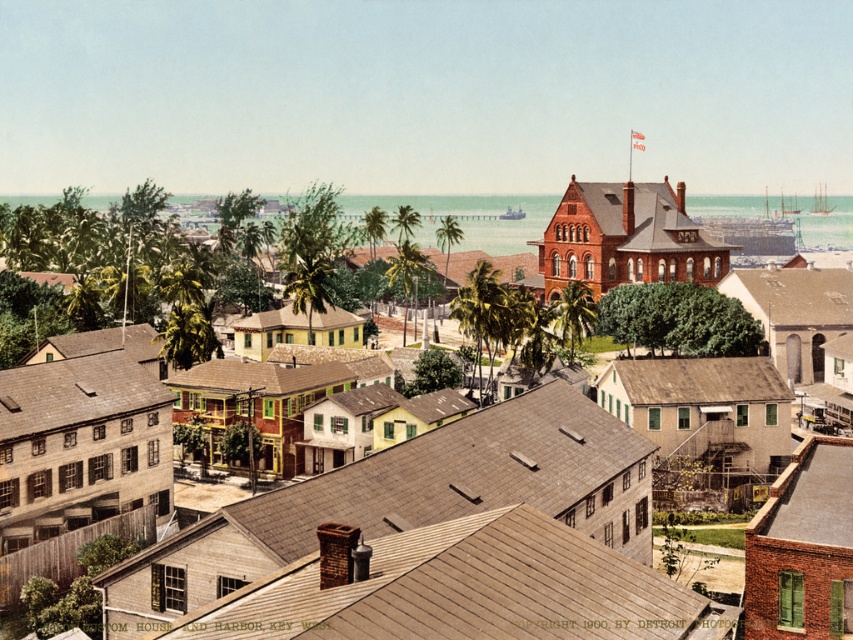
You are an architect analyzing the waterfront scene. You notice the matte brown building at center and the brown shingles at center. Which of these two objects is taller?

The matte brown building at center is much taller than the brown shingles at center.

You are an architect analyzing the waterfront scene. You notice the matte brown building at center and the brown shingles at center. Which object is positioned to the left?

The brown shingles at center are positioned to the left of the matte brown building at center.

You are an architect analyzing the waterfront scene. You need to determine which of the two structures, the matte brown building at center or the brown shingles at center, has a greater width. Based on the scene description, which one is wider?

The matte brown building at center is wider than the brown shingles at center.